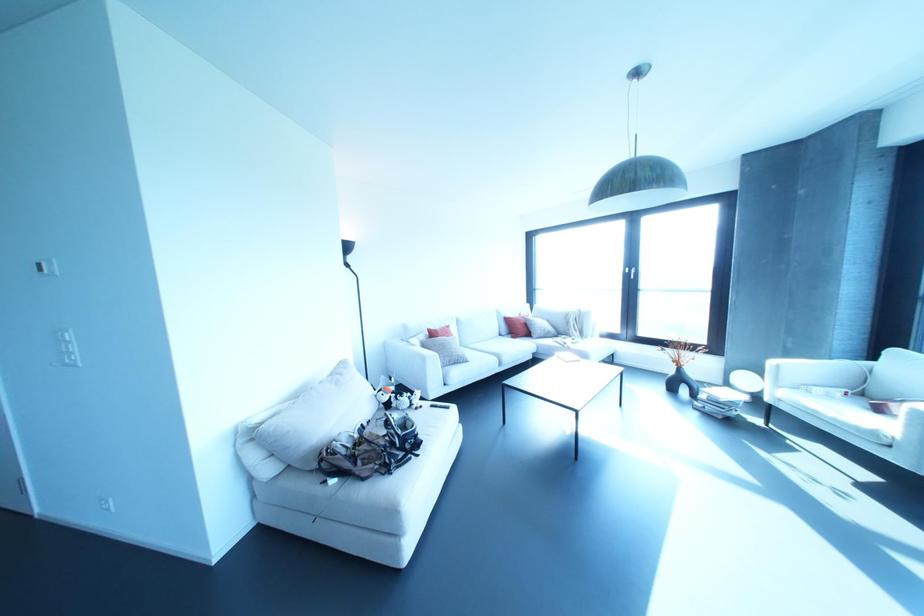
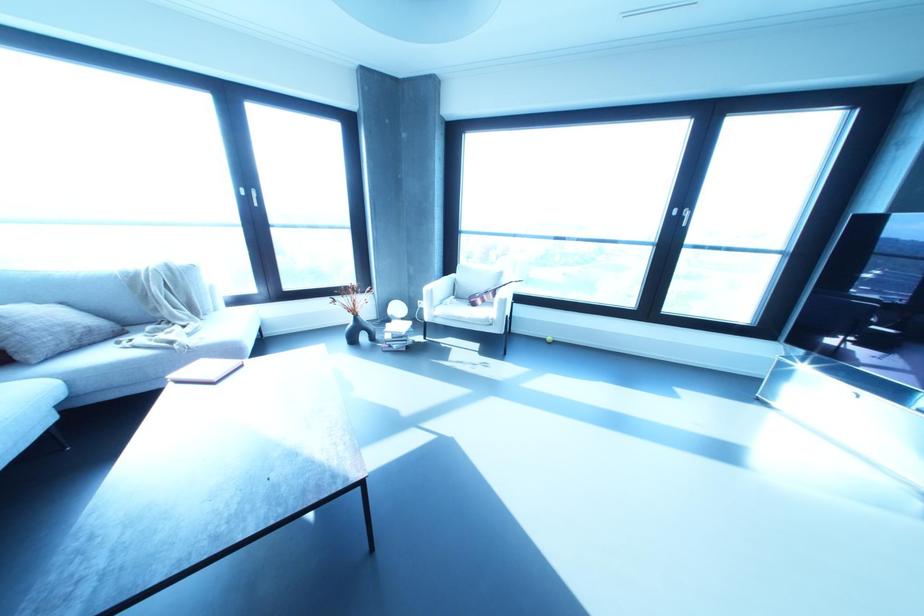
Locate, in the second image, the point that corresponds to (x=719, y=416) in the first image.

(404, 349)